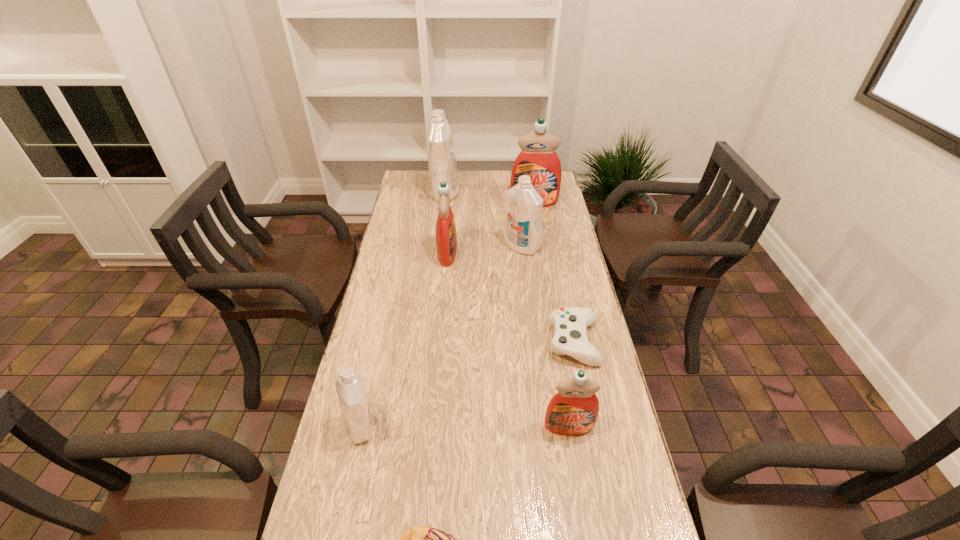
Find the location of a particular element. The width and height of the screenshot is (960, 540). the biggest white detergent is located at coordinates (441, 149).

The height and width of the screenshot is (540, 960). I want to click on the farthest white detergent, so click(x=441, y=149).

The width and height of the screenshot is (960, 540). I want to click on the farthest red detergent, so click(x=538, y=159).

This screenshot has height=540, width=960. In order to click on the rightmost white detergent in this screenshot , I will do `click(523, 228)`.

Locate an element on the screen. The width and height of the screenshot is (960, 540). the second smallest white detergent is located at coordinates (523, 228).

Locate an element on the screen. This screenshot has height=540, width=960. the second smallest red detergent is located at coordinates (446, 237).

Where is `the leftmost red detergent`? The width and height of the screenshot is (960, 540). the leftmost red detergent is located at coordinates (446, 237).

Image resolution: width=960 pixels, height=540 pixels. I want to click on the nearest white detergent, so click(x=353, y=401).

Where is `the leftmost detergent`? the leftmost detergent is located at coordinates (353, 401).

Locate an element on the screen. This screenshot has width=960, height=540. the nearest red detergent is located at coordinates (574, 409).